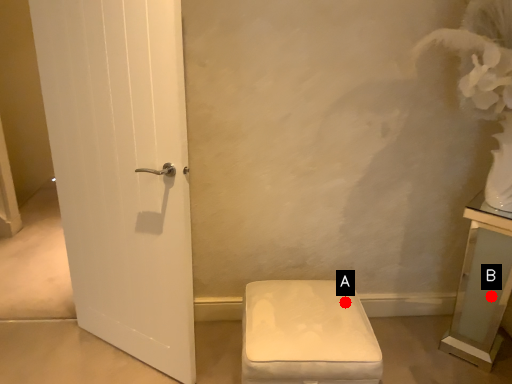
Question: Two points are circled on the image, labeled by A and B beside each circle. Which point is closer to the camera?

Choices:
 (A) A is closer
 (B) B is closer

Answer: (A)